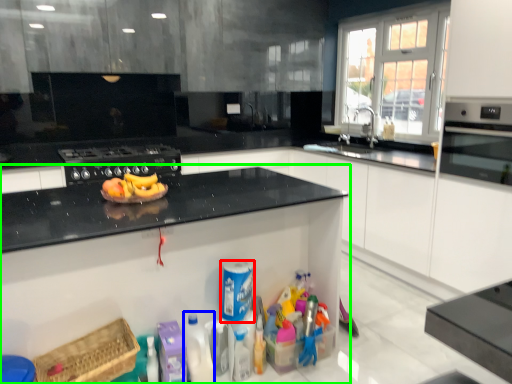
Question: Which is nearer to the cleaning product (highlighted by a red box)? cleaning product (highlighted by a blue box) or cabinetry (highlighted by a green box).

Choices:
 (A) cleaning product
 (B) cabinetry

Answer: (A)